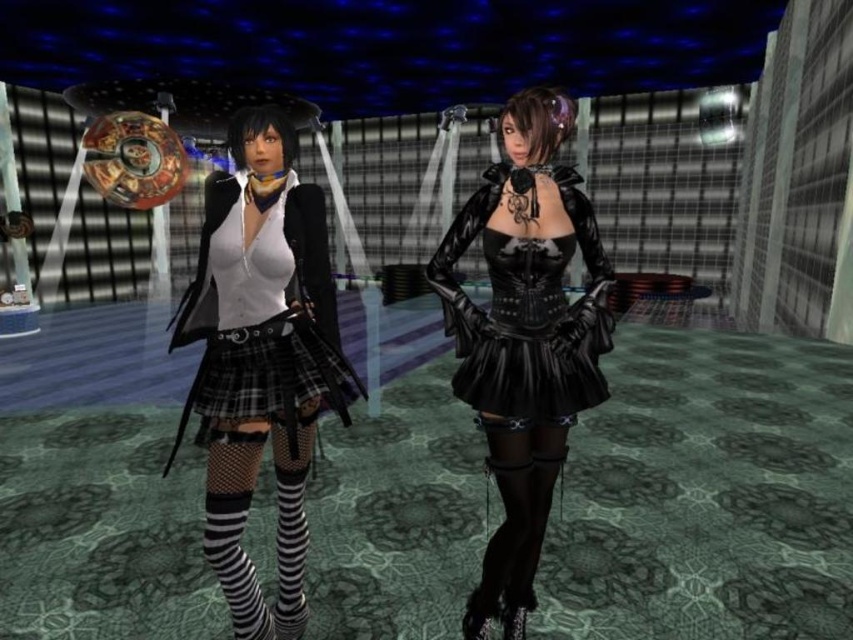
Question: Which of the following is the closest to the observer?

Choices:
 (A) plaid fabric skirt at center
 (B) black leather thigh-high boots at lower center

Answer: (A)

Question: Is black leather dress at center to the right of black leather thigh-high boots at lower center from the viewer's perspective?

Choices:
 (A) no
 (B) yes

Answer: (B)

Question: Can you confirm if black leather dress at center is wider than black leather thigh-high boots at lower center?

Choices:
 (A) yes
 (B) no

Answer: (A)

Question: Which point is closer to the camera taking this photo?

Choices:
 (A) (498, 573)
 (B) (503, 472)
 (C) (210, 412)
 (D) (570, 179)

Answer: (C)

Question: Which point is farther from the camera taking this photo?

Choices:
 (A) 517,486
 (B) 483,317

Answer: (B)

Question: Can you confirm if shiny black leather dress at center is wider than black leather thigh-high boots at lower center?

Choices:
 (A) no
 (B) yes

Answer: (B)